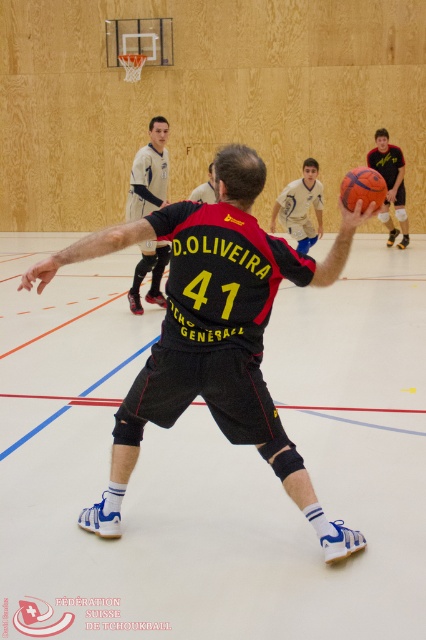
Is black matte jersey at center to the left of orange rubber ball at center from the viewer's perspective?

Correct, you'll find black matte jersey at center to the left of orange rubber ball at center.

Which is below, black matte jersey at center or orange rubber ball at center?

black matte jersey at center is lower down.

The height and width of the screenshot is (640, 426). Identify the location of black matte jersey at center. (213, 332).

At what (x,y) coordinates should I click in order to perform the action: click on black matte jersey at center. Please return your answer as a coordinate pair (x, y). Image resolution: width=426 pixels, height=640 pixels. Looking at the image, I should click on (213, 332).

Does black matte jersey at center lie in front of light blue jersey at center?

Yes, black matte jersey at center is closer to the viewer.

Who is higher up, black matte jersey at center or light blue jersey at center?

light blue jersey at center is higher up.

Does point (196, 257) come closer to viewer compared to point (135, 172)?

Yes, it is.

At what (x,y) coordinates should I click in order to perform the action: click on black matte jersey at center. Please return your answer as a coordinate pair (x, y). Looking at the image, I should click on (213, 332).

Can you confirm if blue jersey at center is thinner than orange rubber ball at center?

Yes.

Who is more forward, [302,177] or [394,148]?

Point [302,177] is more forward.

Between point (308, 189) and point (400, 161), which one is positioned behind?

The point (400, 161) is more distant.

You are a GUI agent. You are given a task and a screenshot of the screen. Output one action in this format:
    pyautogui.click(x=<x>, y=<y>)
    Task: Click on the blue jersey at center
    The height and width of the screenshot is (640, 426).
    Given the screenshot: What is the action you would take?
    pyautogui.click(x=301, y=205)